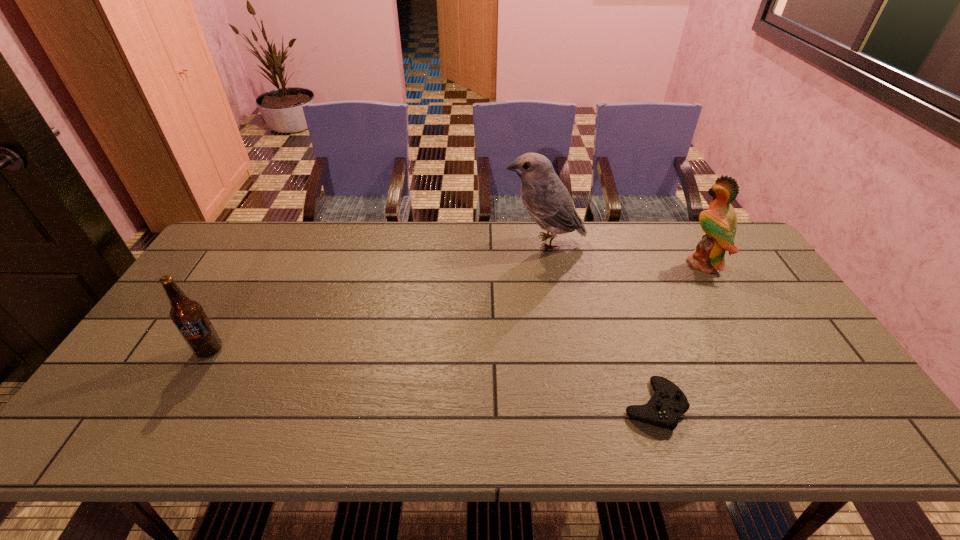
In order to click on the left parrot in this screenshot , I will do `click(547, 200)`.

Find the location of a particular element. Image resolution: width=960 pixels, height=540 pixels. the right parrot is located at coordinates (719, 222).

At what (x,y) coordinates should I click in order to perform the action: click on the leftmost object. Please return your answer as a coordinate pair (x, y). Looking at the image, I should click on (188, 316).

The width and height of the screenshot is (960, 540). What are the coordinates of `beer bottle` in the screenshot? It's located at (188, 316).

You are a GUI agent. You are given a task and a screenshot of the screen. Output one action in this format:
    pyautogui.click(x=<x>, y=<y>)
    Task: Click on the control
    This screenshot has width=960, height=540.
    Given the screenshot: What is the action you would take?
    pyautogui.click(x=667, y=404)

The width and height of the screenshot is (960, 540). Find the location of `the shortest object`. the shortest object is located at coordinates (667, 404).

What are the coordinates of `free space located 0.390m on the front-facing side of the left parrot` in the screenshot? It's located at (387, 242).

Image resolution: width=960 pixels, height=540 pixels. I want to click on vacant area situated 0.070m on the front-facing side of the left parrot, so click(482, 242).

You are a GUI agent. You are given a task and a screenshot of the screen. Output one action in this format:
    pyautogui.click(x=<x>, y=<y>)
    Task: Click on the vacant space positioned 0.070m on the front-facing side of the left parrot
    
    Given the screenshot: What is the action you would take?
    pyautogui.click(x=482, y=242)

I want to click on free space located on the front-facing side of the right parrot, so click(563, 264).